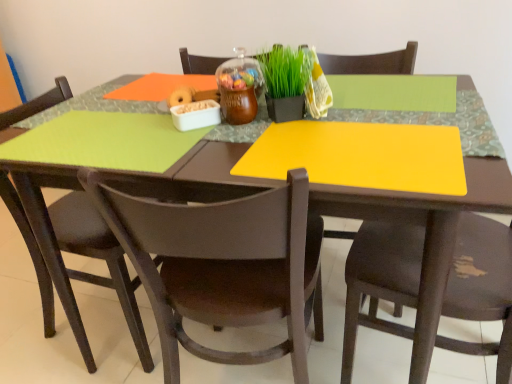
Image resolution: width=512 pixels, height=384 pixels. What do you see at coordinates (285, 71) in the screenshot? I see `green matte plant at center` at bounding box center [285, 71].

Describe the element at coordinates (223, 266) in the screenshot. I see `brown plastic chair at center, placed as the 2th chair when sorted from right to left` at that location.

What do you see at coordinates (97, 258) in the screenshot?
I see `matte brown chair at lower left, which is the 3th chair from right to left` at bounding box center [97, 258].

Where is `green matte plant at center`? green matte plant at center is located at coordinates (285, 71).

Considering the positions of objects matte brown chair at lower right, the 3th chair in the left-to-right sequence, and matte brown chair at lower left, which is the 3th chair from right to left, in the image provided, who is more to the right, matte brown chair at lower right, the 3th chair in the left-to-right sequence, or matte brown chair at lower left, which is the 3th chair from right to left,?

From the viewer's perspective, matte brown chair at lower right, the 3th chair in the left-to-right sequence, appears more on the right side.

Is matte brown chair at lower right, placed as the 1th chair when sorted from right to left, positioned far away from matte brown chair at lower left, which is the 3th chair from right to left?

They are positioned close to each other.

Based on their sizes in the image, would you say matte brown chair at lower right, the 3th chair in the left-to-right sequence, is bigger or smaller than matte brown chair at lower left, which is the 3th chair from right to left?

Considering their sizes, matte brown chair at lower right, the 3th chair in the left-to-right sequence, takes up more space than matte brown chair at lower left, which is the 3th chair from right to left.

Is matte brown chair at lower right, the 3th chair in the left-to-right sequence, positioned before matte brown chair at lower left, which is the 3th chair from right to left?

Yes, it is.

Which is more to the right, matte brown chair at lower right, placed as the 1th chair when sorted from right to left, or green matte plant at center?

Positioned to the right is matte brown chair at lower right, placed as the 1th chair when sorted from right to left.

Is matte brown chair at lower right, placed as the 1th chair when sorted from right to left, in contact with green matte plant at center?

No, matte brown chair at lower right, placed as the 1th chair when sorted from right to left, is not touching green matte plant at center.

Would you say matte brown chair at lower right, the 3th chair in the left-to-right sequence, is outside green matte plant at center?

Yes, matte brown chair at lower right, the 3th chair in the left-to-right sequence, is located beyond the bounds of green matte plant at center.

Does point (500, 272) lie in front of point (278, 48)?

That is False.

Considering the relative sizes of green matte plant at center and matte brown chair at lower right, the 3th chair in the left-to-right sequence, in the image provided, is green matte plant at center wider than matte brown chair at lower right, the 3th chair in the left-to-right sequence,?

No, green matte plant at center is not wider than matte brown chair at lower right, the 3th chair in the left-to-right sequence.

Which object is more forward, green matte plant at center or matte brown chair at lower right, the 3th chair in the left-to-right sequence?

matte brown chair at lower right, the 3th chair in the left-to-right sequence, is more forward.

In the image, is green matte plant at center on the left side or the right side of matte brown chair at lower right, placed as the 1th chair when sorted from right to left?

green matte plant at center is positioned on matte brown chair at lower right, placed as the 1th chair when sorted from right to left,'s left side.

From a real-world perspective, between matte brown chair at lower right, placed as the 1th chair when sorted from right to left, and brown plastic chair at center, the 2th chair viewed from the left, who is vertically lower?

From a 3D spatial view, matte brown chair at lower right, placed as the 1th chair when sorted from right to left, is below.

Which is behind, matte brown chair at lower right, placed as the 1th chair when sorted from right to left, or brown plastic chair at center, the 2th chair viewed from the left?

brown plastic chair at center, the 2th chair viewed from the left.

Locate an element on the screen. chair above the matte brown chair at lower right, the 3th chair in the left-to-right sequence (from a real-world perspective) is located at coordinates (223, 266).

Is point (511, 323) farther from viewer compared to point (150, 248)?

Yes, it is.

Is point (23, 174) closer to viewer compared to point (298, 51)?

No, (23, 174) is further to viewer.

There is a green matte plant at center. Where is `the 1st chair below it (from the image's perspective)`? This screenshot has width=512, height=384. the 1st chair below it (from the image's perspective) is located at coordinates (97, 258).

Are matte brown chair at lower left, which is the 3th chair from right to left, and green matte plant at center making contact?

No, matte brown chair at lower left, which is the 3th chair from right to left, is not touching green matte plant at center.

Who is bigger, green matte plant at center or brown plastic chair at center, placed as the 2th chair when sorted from right to left?

With larger size is brown plastic chair at center, placed as the 2th chair when sorted from right to left.

Considering the positions of point (277, 47) and point (195, 267), is point (277, 47) closer or farther from the camera than point (195, 267)?

Point (277, 47).

How different are the orientations of green matte plant at center and brown plastic chair at center, the 2th chair viewed from the left, in degrees?

There is a 159-degree angle between the facing directions of green matte plant at center and brown plastic chair at center, the 2th chair viewed from the left.

Could you tell me if green matte plant at center is turned towards brown plastic chair at center, the 2th chair viewed from the left?

No, green matte plant at center is not turned towards brown plastic chair at center, the 2th chair viewed from the left.

Does brown plastic chair at center, placed as the 2th chair when sorted from right to left, touch matte brown chair at lower right, placed as the 1th chair when sorted from right to left?

brown plastic chair at center, placed as the 2th chair when sorted from right to left, is not next to matte brown chair at lower right, placed as the 1th chair when sorted from right to left, and they're not touching.

Is point (231, 217) behind point (501, 372)?

No, (231, 217) is closer to viewer.

Do you think brown plastic chair at center, the 2th chair viewed from the left, is within matte brown chair at lower right, placed as the 1th chair when sorted from right to left, or outside of it?

brown plastic chair at center, the 2th chair viewed from the left, exists outside the volume of matte brown chair at lower right, placed as the 1th chair when sorted from right to left.

How many degrees apart are the facing directions of brown plastic chair at center, placed as the 2th chair when sorted from right to left, and matte brown chair at lower right, the 3th chair in the left-to-right sequence?

76.2 degrees.

This screenshot has width=512, height=384. Identify the location of chair that is the 1st object above the matte brown chair at lower left, placed as the 1th chair when sorted from left to right (from a real-world perspective). (481, 287).

At what (x,y) coordinates should I click in order to perform the action: click on plant on the left of matte brown chair at lower right, the 3th chair in the left-to-right sequence. Please return your answer as a coordinate pair (x, y). This screenshot has height=384, width=512. Looking at the image, I should click on (285, 71).

Estimate the real-world distances between objects in this image. Which object is further from matte brown chair at lower left, which is the 3th chair from right to left, brown plastic chair at center, the 2th chair viewed from the left, or matte brown chair at lower right, placed as the 1th chair when sorted from right to left?

The object further to matte brown chair at lower left, which is the 3th chair from right to left, is matte brown chair at lower right, placed as the 1th chair when sorted from right to left.

Looking at the image, which one is located closer to matte brown chair at lower right, placed as the 1th chair when sorted from right to left, brown plastic chair at center, placed as the 2th chair when sorted from right to left, or green matte plant at center?

brown plastic chair at center, placed as the 2th chair when sorted from right to left.

Looking at the image, which one is located further to green matte plant at center, matte brown chair at lower right, the 3th chair in the left-to-right sequence, or matte brown chair at lower left, placed as the 1th chair when sorted from left to right?

Based on the image, matte brown chair at lower left, placed as the 1th chair when sorted from left to right, appears to be further to green matte plant at center.

Considering their positions, is green matte plant at center positioned further to matte brown chair at lower right, placed as the 1th chair when sorted from right to left, than matte brown chair at lower left, placed as the 1th chair when sorted from left to right?

The object further to matte brown chair at lower right, placed as the 1th chair when sorted from right to left, is matte brown chair at lower left, placed as the 1th chair when sorted from left to right.

Which object lies nearer to the anchor point brown plastic chair at center, the 2th chair viewed from the left, matte brown chair at lower left, placed as the 1th chair when sorted from left to right, or green matte plant at center?

The object closer to brown plastic chair at center, the 2th chair viewed from the left, is matte brown chair at lower left, placed as the 1th chair when sorted from left to right.

Considering their positions, is matte brown chair at lower left, which is the 3th chair from right to left, positioned closer to matte brown chair at lower right, the 3th chair in the left-to-right sequence, than green matte plant at center?

green matte plant at center lies closer to matte brown chair at lower right, the 3th chair in the left-to-right sequence, than the other object.

Looking at the image, which one is located closer to brown plastic chair at center, the 2th chair viewed from the left, green matte plant at center or matte brown chair at lower right, the 3th chair in the left-to-right sequence?

The object closer to brown plastic chair at center, the 2th chair viewed from the left, is matte brown chair at lower right, the 3th chair in the left-to-right sequence.

Looking at the image, which one is located further to matte brown chair at lower left, which is the 3th chair from right to left, green matte plant at center or brown plastic chair at center, placed as the 2th chair when sorted from right to left?

green matte plant at center.

Find the location of `plant between brown plastic chair at center, placed as the 2th chair when sorted from right to left, and matte brown chair at lower right, the 3th chair in the left-to-right sequence, from left to right`. plant between brown plastic chair at center, placed as the 2th chair when sorted from right to left, and matte brown chair at lower right, the 3th chair in the left-to-right sequence, from left to right is located at coordinates (285, 71).

I want to click on chair between matte brown chair at lower left, which is the 3th chair from right to left, and green matte plant at center, so click(223, 266).

Where is `plant situated between matte brown chair at lower left, placed as the 1th chair when sorted from left to right, and matte brown chair at lower right, placed as the 1th chair when sorted from right to left, from left to right`? plant situated between matte brown chair at lower left, placed as the 1th chair when sorted from left to right, and matte brown chair at lower right, placed as the 1th chair when sorted from right to left, from left to right is located at coordinates pos(285,71).

At what (x,y) coordinates should I click in order to perform the action: click on chair between matte brown chair at lower left, placed as the 1th chair when sorted from left to right, and matte brown chair at lower right, the 3th chair in the left-to-right sequence, from left to right. Please return your answer as a coordinate pair (x, y). The width and height of the screenshot is (512, 384). Looking at the image, I should click on (223, 266).